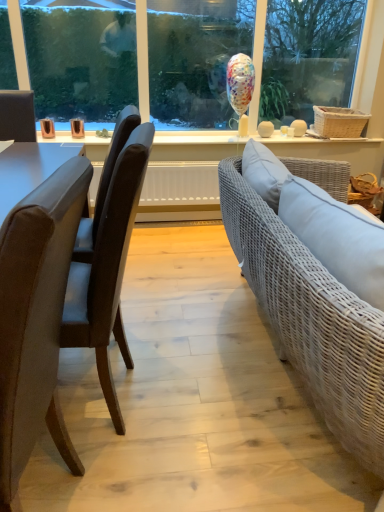
Question: Is leather chair at left, the second chair from the front, wider or thinner than brown leather chair at left, positioned as the 2th chair in back-to-front order?

Choices:
 (A) wide
 (B) thin

Answer: (A)

Question: Do you think leather chair at left, the 1th chair from the back, is within brown leather chair at left, which is the 1th chair from front to back, or outside of it?

Choices:
 (A) outside
 (B) inside

Answer: (A)

Question: Considering the positions of leather chair at left, the 1th chair from the back, and brown leather chair at left, positioned as the 2th chair in back-to-front order, in the image, is leather chair at left, the 1th chair from the back, taller or shorter than brown leather chair at left, positioned as the 2th chair in back-to-front order,?

Choices:
 (A) short
 (B) tall

Answer: (B)

Question: From the image's perspective, is brown leather chair at left, positioned as the 2th chair in back-to-front order, located above or below leather chair at left, the 1th chair from the back?

Choices:
 (A) above
 (B) below

Answer: (B)

Question: Relative to leather chair at left, the 1th chair from the back, is brown leather chair at left, which is the 1th chair from front to back, in front or behind?

Choices:
 (A) front
 (B) behind

Answer: (A)

Question: Based on their sizes in the image, would you say brown leather chair at left, which is the 1th chair from front to back, is bigger or smaller than leather chair at left, the second chair from the front?

Choices:
 (A) small
 (B) big

Answer: (A)

Question: Considering the positions of brown leather chair at left, positioned as the 2th chair in back-to-front order, and leather chair at left, the second chair from the front, in the image, is brown leather chair at left, positioned as the 2th chair in back-to-front order, wider or thinner than leather chair at left, the second chair from the front,?

Choices:
 (A) wide
 (B) thin

Answer: (B)